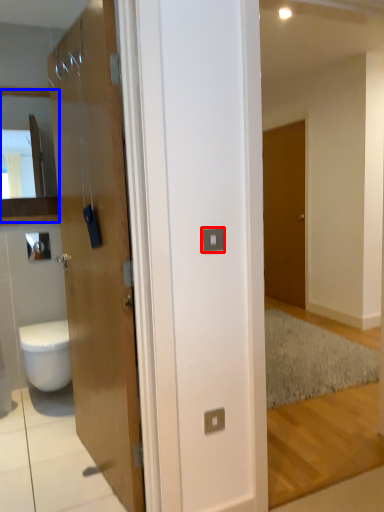
Question: Which object appears closest to the camera in this image, electric outlet (highlighted by a red box) or cabinet (highlighted by a blue box)?

Choices:
 (A) electric outlet
 (B) cabinet

Answer: (A)